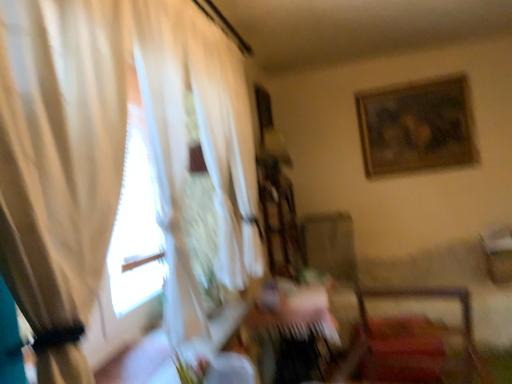
Question: Should I look upward or downward to see white sheer curtain at left?

Choices:
 (A) down
 (B) up

Answer: (A)

Question: Considering the relative positions of wooden table at center and velvet red chair at lower right in the image provided, is wooden table at center to the left of velvet red chair at lower right from the viewer's perspective?

Choices:
 (A) yes
 (B) no

Answer: (A)

Question: Does wooden table at center have a greater width compared to velvet red chair at lower right?

Choices:
 (A) no
 (B) yes

Answer: (A)

Question: Can you confirm if wooden table at center is taller than velvet red chair at lower right?

Choices:
 (A) yes
 (B) no

Answer: (A)

Question: From a real-world perspective, is wooden table at center beneath velvet red chair at lower right?

Choices:
 (A) yes
 (B) no

Answer: (A)

Question: Is wooden table at center with velvet red chair at lower right?

Choices:
 (A) yes
 (B) no

Answer: (B)

Question: Can you confirm if wooden table at center is smaller than velvet red chair at lower right?

Choices:
 (A) no
 (B) yes

Answer: (A)

Question: Is wooden framed artwork at upper right in front of velvet red chair at lower right?

Choices:
 (A) yes
 (B) no

Answer: (B)

Question: From the image's perspective, is wooden framed artwork at upper right located beneath velvet red chair at lower right?

Choices:
 (A) no
 (B) yes

Answer: (A)

Question: Is wooden framed artwork at upper right oriented towards velvet red chair at lower right?

Choices:
 (A) yes
 (B) no

Answer: (A)

Question: Considering the relative sizes of wooden framed artwork at upper right and velvet red chair at lower right in the image provided, is wooden framed artwork at upper right smaller than velvet red chair at lower right?

Choices:
 (A) yes
 (B) no

Answer: (A)

Question: From a real-world perspective, is wooden framed artwork at upper right on top of velvet red chair at lower right?

Choices:
 (A) yes
 (B) no

Answer: (A)

Question: Is wooden framed artwork at upper right thinner than velvet red chair at lower right?

Choices:
 (A) no
 (B) yes

Answer: (B)

Question: From the image's perspective, is wooden framed artwork at upper right on wooden table at center?

Choices:
 (A) yes
 (B) no

Answer: (A)